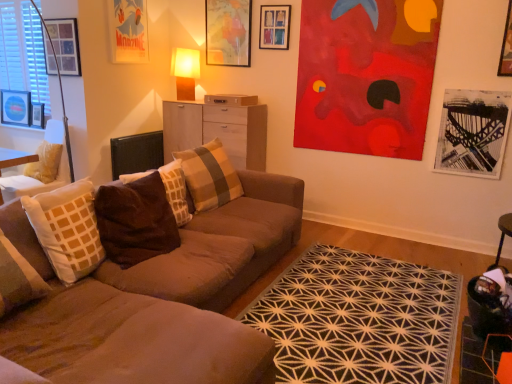
Question: From the image's perspective, is brown velvety pillow at center, arranged as the 1th pillow when viewed from the front, located above or below wooden picture frame at upper center, acting as the 2th picture frame starting from the right?

Choices:
 (A) below
 (B) above

Answer: (A)

Question: Does point [130, 221] appear closer or farther from the camera than point [286, 18]?

Choices:
 (A) closer
 (B) farther

Answer: (A)

Question: Which of these objects is positioned closest to the brown velvety pillow at center, placed as the second pillow when sorted from back to front?

Choices:
 (A) brown fabric couch at center
 (B) light wood cabinet at center
 (C) wooden picture frame at upper left, the third picture frame when ordered from left to right
 (D) wooden picture frame at upper left, placed as the 2th picture frame when sorted from left to right
 (E) matte paper poster at upper left, which appears as the 4th picture frame when viewed from the right

Answer: (A)

Question: Based on their relative distances, which object is nearer to the brown velvety pillow at center, the third pillow when ordered from back to front?

Choices:
 (A) wooden picture frame at upper left, the sixth picture frame positioned from the right
 (B) wooden picture frame at upper center, the sixth picture frame positioned from the left
 (C) matte brown table lamp at upper center
 (D) wooden picture frame at upper left, acting as the fifth picture frame starting from the right
 (E) brown fabric couch at center

Answer: (E)